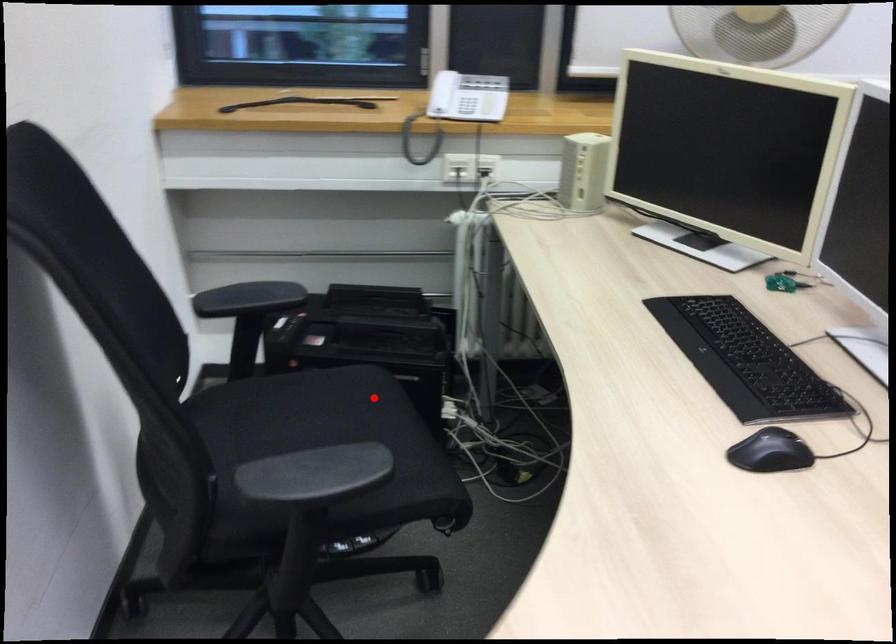
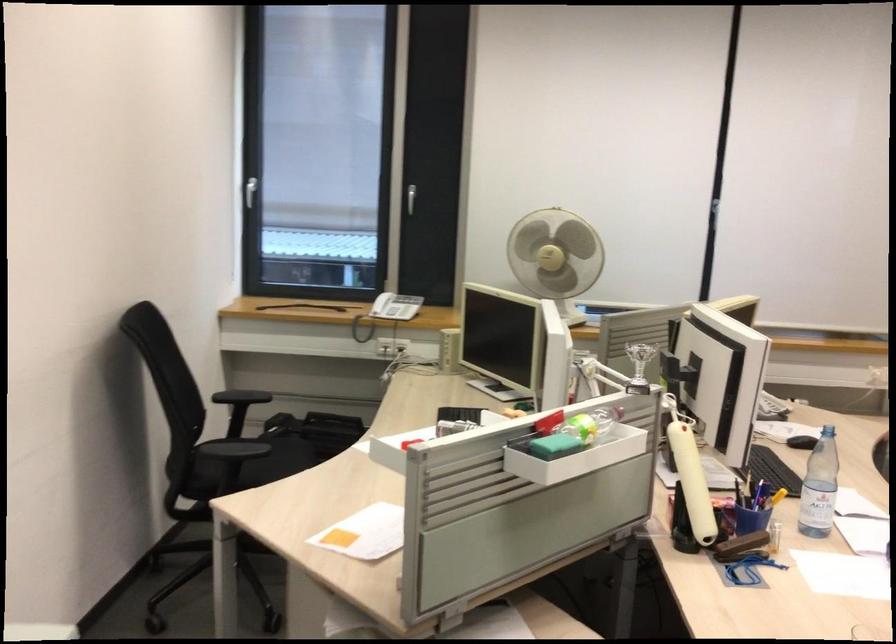
Question: I am providing you with two images of the same scene from different viewpoints. Image1 has a red point marked. In image2, the corresponding 3D location appears at what relative position? Reply with the corresponding letter.

Choices:
 (A) Closer
 (B) Farther

Answer: (B)